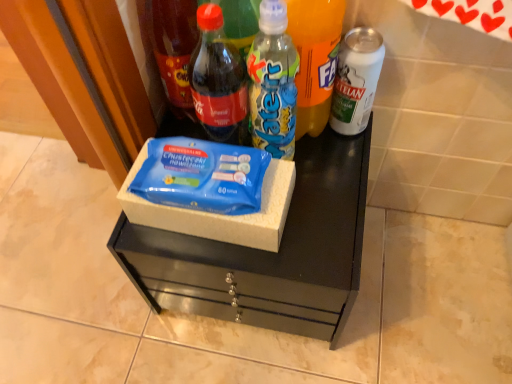
This screenshot has height=384, width=512. What are the coordinates of `free spot in front of translucent plastic bottle at center, the fourth bottle positioned from the left` in the screenshot? It's located at click(x=313, y=202).